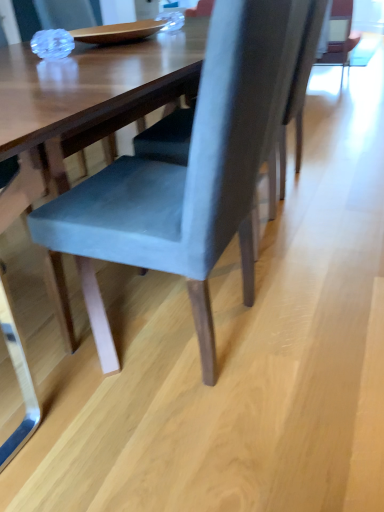
Where is `vacant region in front of velvet blue chair at center, the 2th chair from the back`? The image size is (384, 512). vacant region in front of velvet blue chair at center, the 2th chair from the back is located at coordinates (178, 440).